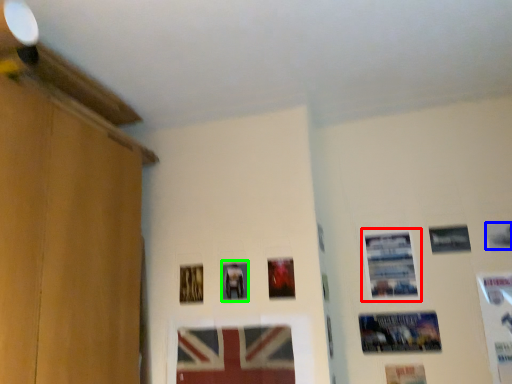
Question: Considering the real-world distances, which object is farthest from picture frame (highlighted by a red box)? picture frame (highlighted by a blue box) or picture frame (highlighted by a green box)?

Choices:
 (A) picture frame
 (B) picture frame

Answer: (B)